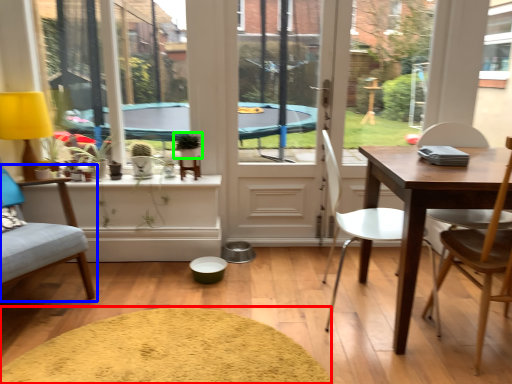
Question: Considering the real-world distances, which object is farthest from wide (highlighted by a red box)? chair (highlighted by a blue box) or plant (highlighted by a green box)?

Choices:
 (A) chair
 (B) plant

Answer: (B)